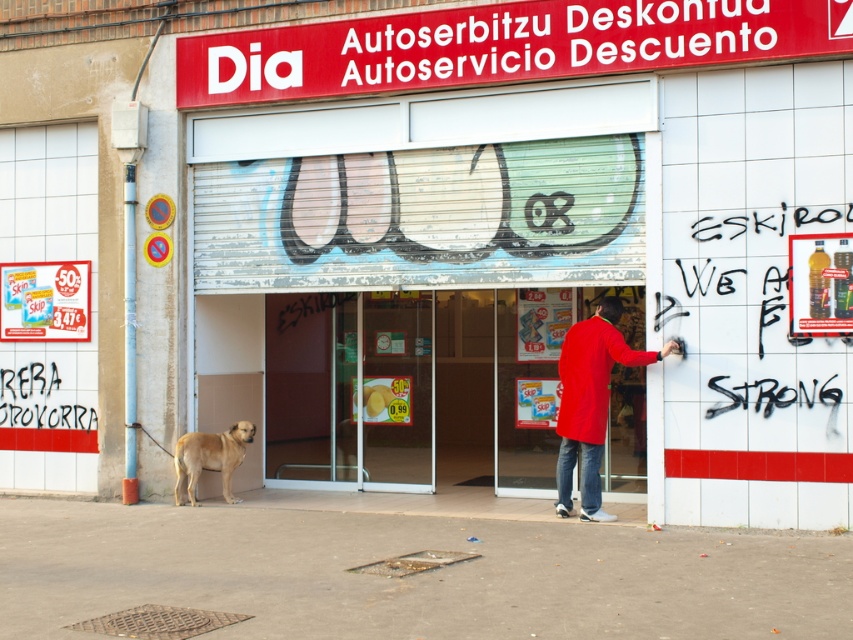
Question: Can you confirm if metallic silver door at center is thinner than matte red coat at center?

Choices:
 (A) yes
 (B) no

Answer: (A)

Question: Does metallic silver door at center appear on the left side of black graffiti at right?

Choices:
 (A) yes
 (B) no

Answer: (A)

Question: Which point is farther to the camera?

Choices:
 (A) (602, 520)
 (B) (199, 300)
 (C) (219, 452)
 (D) (699, 278)

Answer: (B)

Question: Which point is farther to the camera?

Choices:
 (A) (584, 342)
 (B) (341, 109)
 (C) (184, 464)
 (D) (833, 316)

Answer: (C)

Question: Among these objects, which one is farthest from the camera?

Choices:
 (A) golden fur dog at lower left
 (B) matte red coat at center
 (C) metallic silver door at center
 (D) black graffiti at right

Answer: (C)

Question: Does metallic silver door at center appear under black graffiti at right?

Choices:
 (A) yes
 (B) no

Answer: (A)